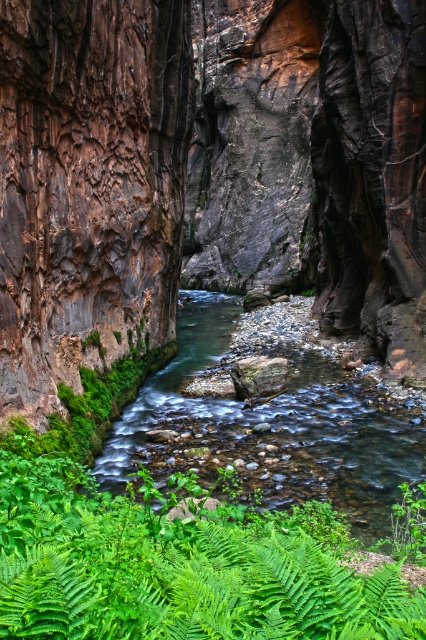
Between green leafy ferns at center and clear water stream at center, which one has less height?

green leafy ferns at center

Which is more to the left, green leafy ferns at center or clear water stream at center?

Positioned to the left is green leafy ferns at center.

Which is behind, point (304, 628) or point (388, 435)?

The point (388, 435) is more distant.

Where is `green leafy ferns at center`? The image size is (426, 640). green leafy ferns at center is located at coordinates (178, 564).

This screenshot has width=426, height=640. Describe the element at coordinates (89, 186) in the screenshot. I see `brown rough cliff at left` at that location.

Between brown rough cliff at left and green leafy ferns at center, which one is positioned lower?

green leafy ferns at center is below.

Does point (146, 150) lie behind point (45, 625)?

Yes, point (146, 150) is behind point (45, 625).

Find the location of a particular element. The image size is (426, 640). brown rough cliff at left is located at coordinates (89, 186).

Who is positioned more to the left, brown rough cliff at left or clear water stream at center?

From the viewer's perspective, brown rough cliff at left appears more on the left side.

Is brown rough cliff at left to the right of clear water stream at center from the viewer's perspective?

Incorrect, brown rough cliff at left is not on the right side of clear water stream at center.

Does point (121, 6) come in front of point (144, 381)?

Yes, it is in front of point (144, 381).

Identify the location of brown rough cliff at left. Image resolution: width=426 pixels, height=640 pixels. (89, 186).